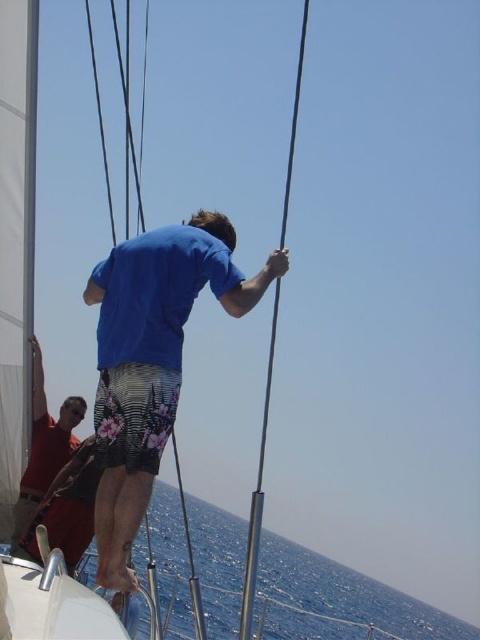
Is blue fabric shirt at center in front of blue water at lower left?

Yes, it is in front of blue water at lower left.

Is point (103, 262) closer to viewer compared to point (313, 618)?

Yes.

Identify the location of blue fabric shirt at center. (152, 360).

Is blue water at lower left to the right of polished metal mast at center from the viewer's perspective?

No, blue water at lower left is not to the right of polished metal mast at center.

Between point (337, 563) and point (244, 570), which one is positioned behind?

Positioned behind is point (337, 563).

This screenshot has height=640, width=480. I want to click on blue water at lower left, so click(x=348, y=593).

Which is in front, point (110, 586) or point (63, 406)?

Point (110, 586) is in front.

Is point (98, 324) more distant than point (22, 497)?

No, (98, 324) is in front of (22, 497).

This screenshot has height=640, width=480. Identify the location of blue fabric shirt at center. (152, 360).